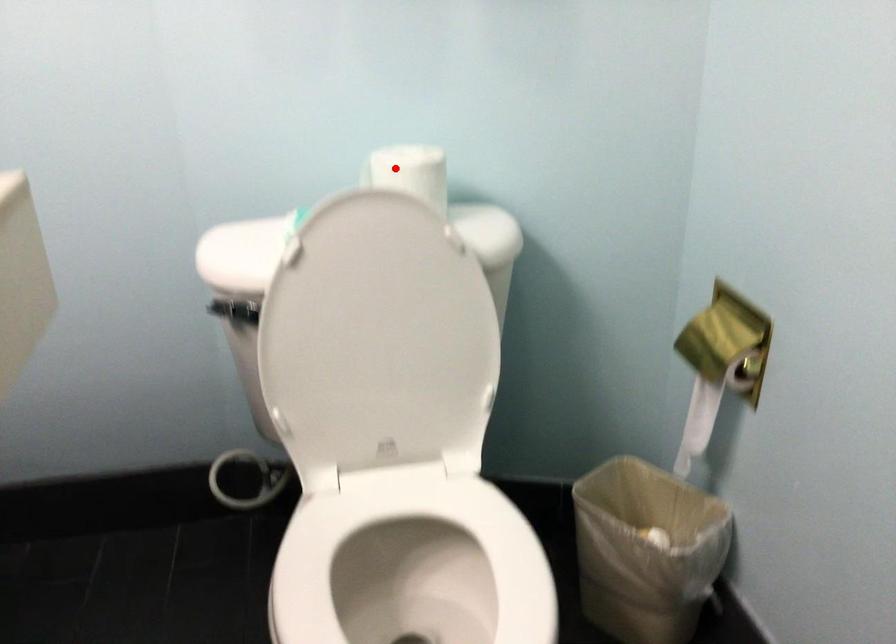
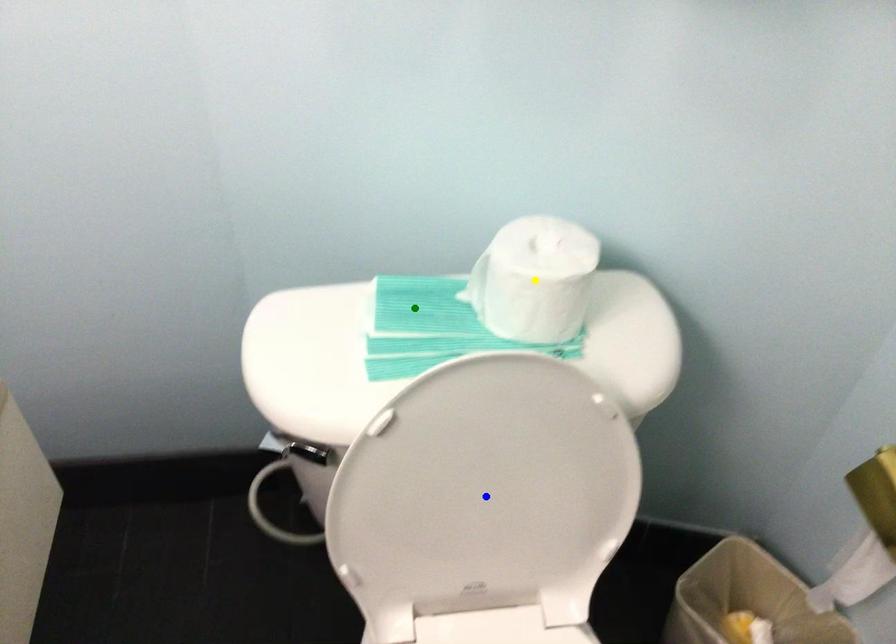
Question: I am providing you with two images of the same scene from different viewpoints. A red point is marked on the first image. You are given multiple points on the second image. Which point in image 2 represents the same 3d spot as the red point in image 1?

Choices:
 (A) blue point
 (B) yellow point
 (C) green point

Answer: (B)